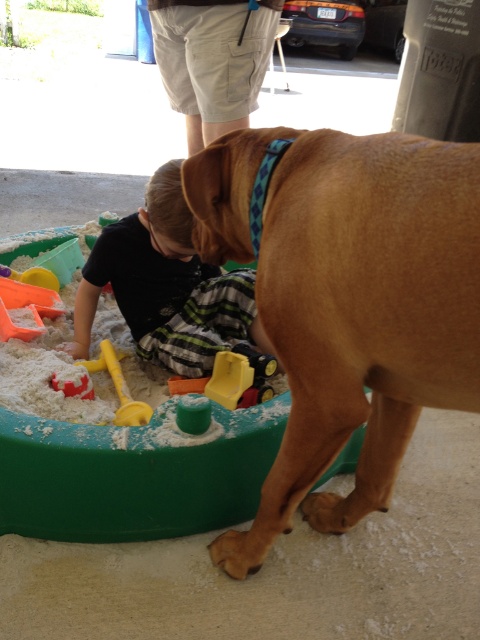
Is point (126, 422) in front of point (73, 392)?

Yes, point (126, 422) is closer to viewer.

Which is behind, point (119, 387) or point (91, 392)?

The point (119, 387) is behind.

Locate an element on the screen. The width and height of the screenshot is (480, 640). yellow plastic shovel at lower left is located at coordinates (119, 387).

Is golden fur dog at right taller than black cotton shirt at lower left?

Yes, golden fur dog at right is taller than black cotton shirt at lower left.

Between golden fur dog at right and black cotton shirt at lower left, which one appears on the right side from the viewer's perspective?

From the viewer's perspective, golden fur dog at right appears more on the right side.

Measure the distance between golden fur dog at right and camera.

golden fur dog at right is 95.98 centimeters from camera.

Find the location of a particular element. golden fur dog at right is located at coordinates (348, 301).

Between black cotton shirt at lower left and red plastic shovel at lower left, which one has less height?

With less height is red plastic shovel at lower left.

Is black cotton shirt at lower left above red plastic shovel at lower left?

Yes.

Between point (178, 268) and point (67, 387), which one is positioned behind?

The point (178, 268) is behind.

Locate an element on the screen. black cotton shirt at lower left is located at coordinates (165, 282).